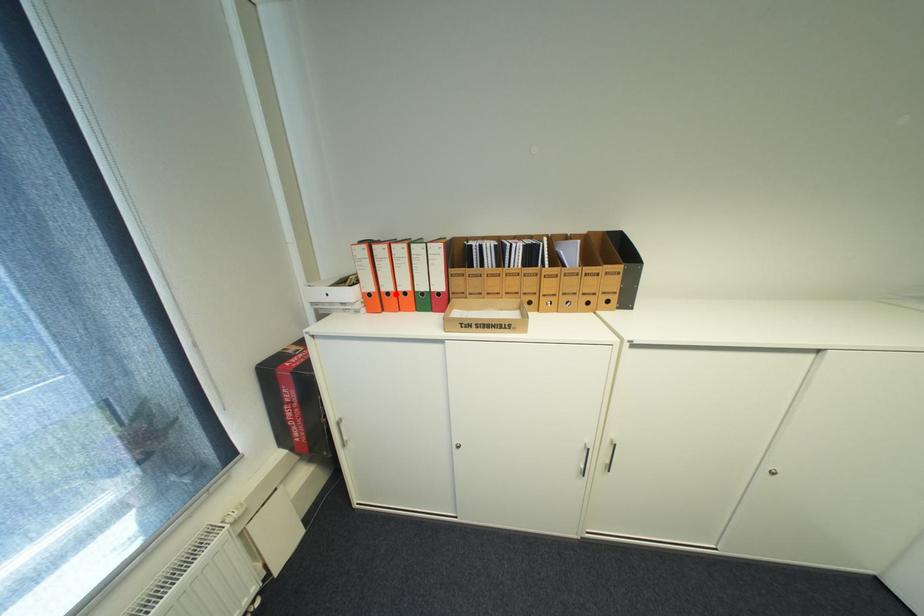
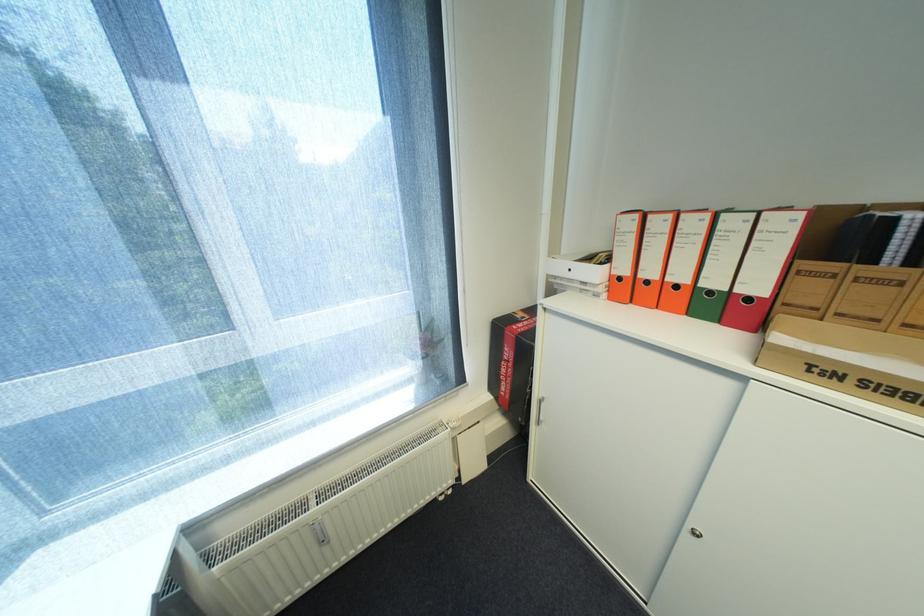
Where in the second image is the point corresponding to the highlighted location from the first image?

(655, 283)